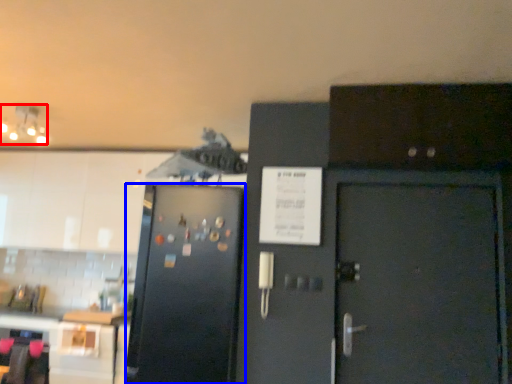
Question: Which object is closer to the camera taking this photo, lamp (highlighted by a red box) or refrigerator (highlighted by a blue box)?

Choices:
 (A) lamp
 (B) refrigerator

Answer: (B)